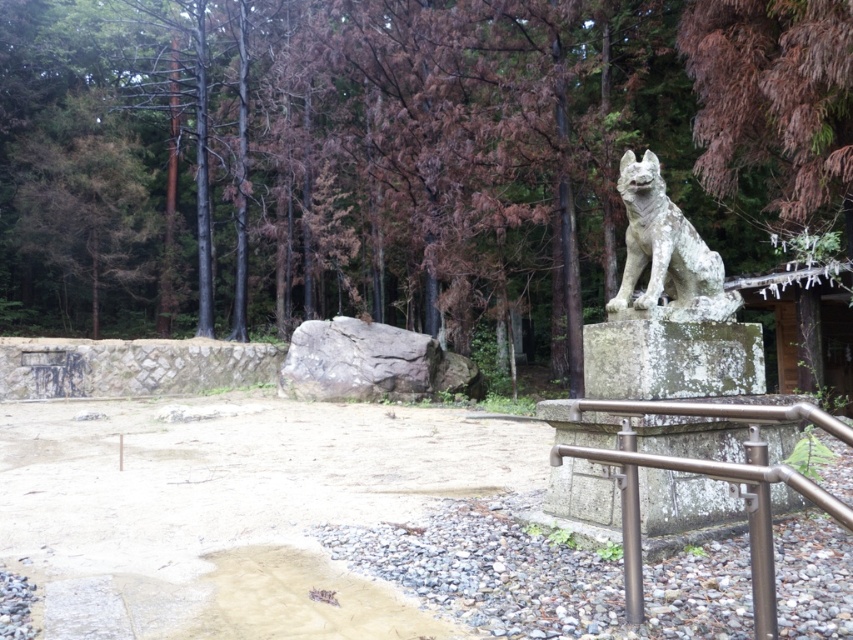
Question: Among these points, which one is nearest to the camera?

Choices:
 (A) (677, 218)
 (B) (721, 470)

Answer: (B)

Question: Is satin silver railing at lower right bigger than white stone statue at upper right?

Choices:
 (A) yes
 (B) no

Answer: (A)

Question: Considering the relative positions of satin silver railing at lower right and white stone statue at upper right in the image provided, where is satin silver railing at lower right located with respect to white stone statue at upper right?

Choices:
 (A) right
 (B) left

Answer: (B)

Question: Among these objects, which one is nearest to the camera?

Choices:
 (A) white stone statue at upper right
 (B) green textured rock at center
 (C) satin silver railing at lower right

Answer: (C)

Question: Does green textured rock at center appear over white stone statue at upper right?

Choices:
 (A) no
 (B) yes

Answer: (B)

Question: Among these points, which one is nearest to the camera?

Choices:
 (A) [x=103, y=198]
 (B) [x=665, y=230]

Answer: (B)